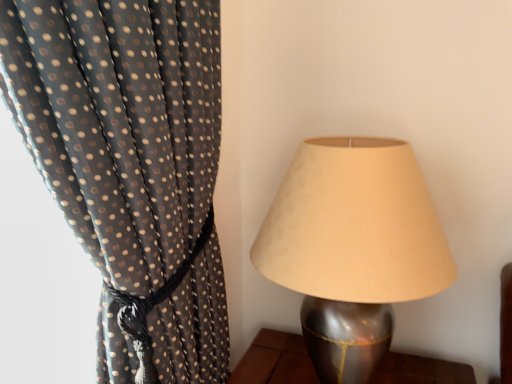
Question: From the image's perspective, is black sheer fabric with gold dots at left over metallic silver lampshade at right?

Choices:
 (A) yes
 (B) no

Answer: (A)

Question: Is black sheer fabric with gold dots at left far from metallic silver lampshade at right?

Choices:
 (A) no
 (B) yes

Answer: (A)

Question: Is black sheer fabric with gold dots at left aimed at metallic silver lampshade at right?

Choices:
 (A) no
 (B) yes

Answer: (A)

Question: Considering the relative sizes of black sheer fabric with gold dots at left and metallic silver lampshade at right in the image provided, is black sheer fabric with gold dots at left taller than metallic silver lampshade at right?

Choices:
 (A) no
 (B) yes

Answer: (B)

Question: From a real-world perspective, is black sheer fabric with gold dots at left physically above metallic silver lampshade at right?

Choices:
 (A) no
 (B) yes

Answer: (B)

Question: Is black sheer fabric with gold dots at left thinner than metallic silver lampshade at right?

Choices:
 (A) no
 (B) yes

Answer: (A)

Question: From a real-world perspective, is metallic silver lampshade at right on top of black sheer fabric with gold dots at left?

Choices:
 (A) no
 (B) yes

Answer: (A)

Question: Would you say black sheer fabric with gold dots at left is part of metallic silver lampshade at right's contents?

Choices:
 (A) no
 (B) yes

Answer: (A)

Question: Is metallic silver lampshade at right not close to black sheer fabric with gold dots at left?

Choices:
 (A) yes
 (B) no

Answer: (B)

Question: Could you tell me if metallic silver lampshade at right is facing black sheer fabric with gold dots at left?

Choices:
 (A) no
 (B) yes

Answer: (A)

Question: Is metallic silver lampshade at right in contact with black sheer fabric with gold dots at left?

Choices:
 (A) yes
 (B) no

Answer: (B)

Question: Is metallic silver lampshade at right to the left of black sheer fabric with gold dots at left from the viewer's perspective?

Choices:
 (A) no
 (B) yes

Answer: (A)

Question: In the image, is black sheer fabric with gold dots at left on the left side or the right side of metallic silver lampshade at right?

Choices:
 (A) left
 (B) right

Answer: (A)